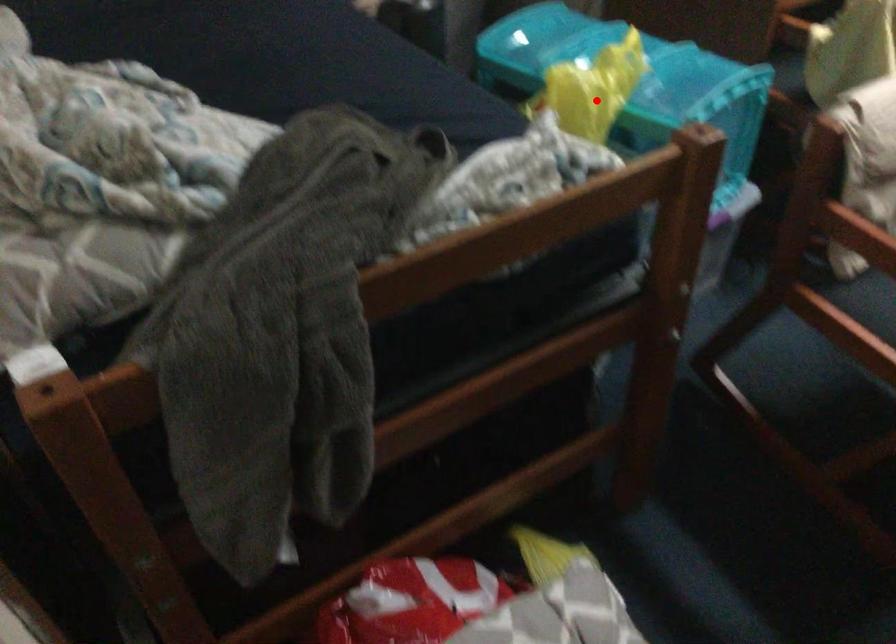
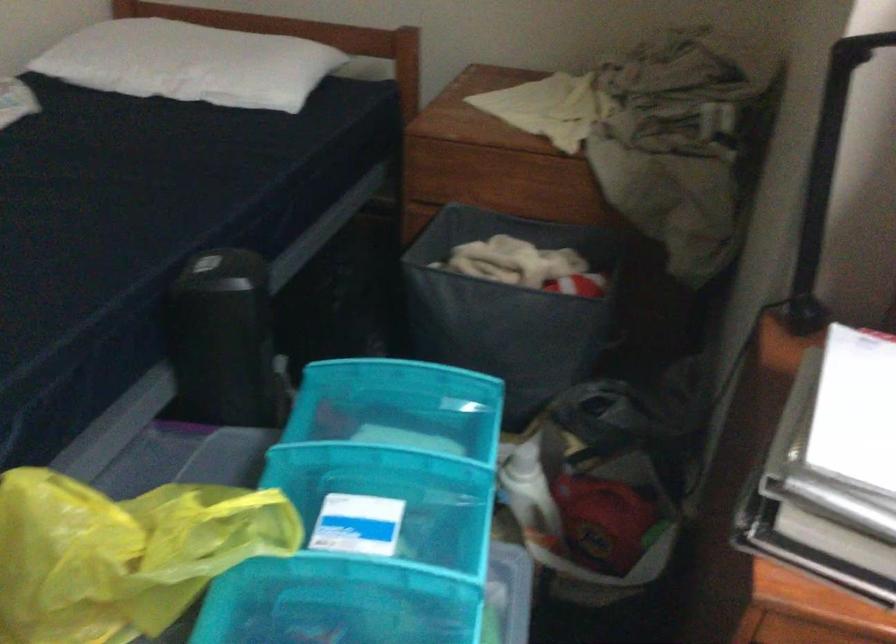
Question: I am providing you with two images of the same scene from different viewpoints. Image1 has a red point marked. In image2, the corresponding 3D location appears at what relative position? Reply with the corresponding letter.

Choices:
 (A) Closer
 (B) Farther

Answer: (A)